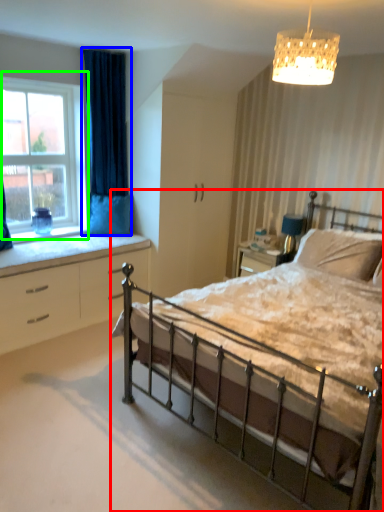
Question: Estimate the real-world distances between objects in this image. Which object is closer to bed (highlighted by a red box), curtain (highlighted by a blue box) or window (highlighted by a green box)?

Choices:
 (A) curtain
 (B) window

Answer: (A)